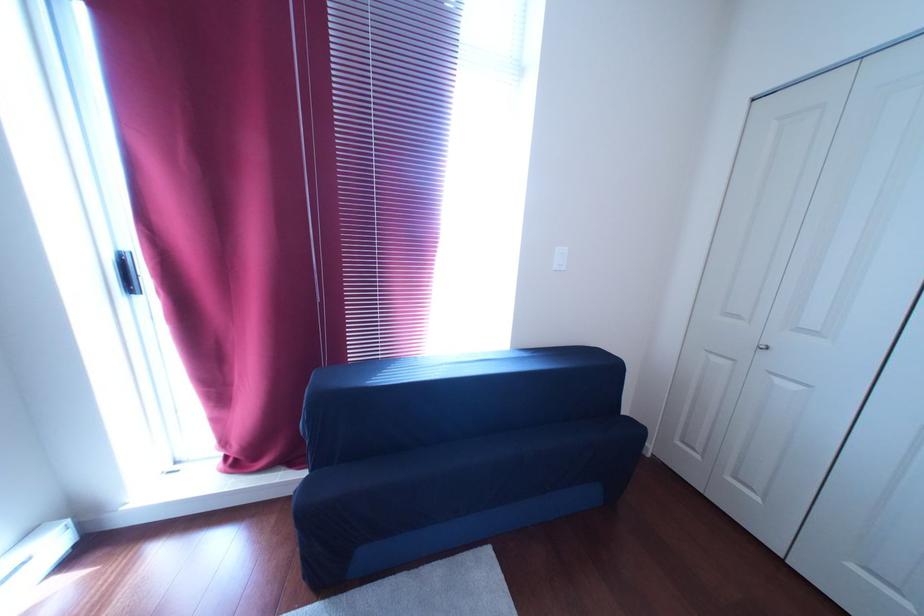
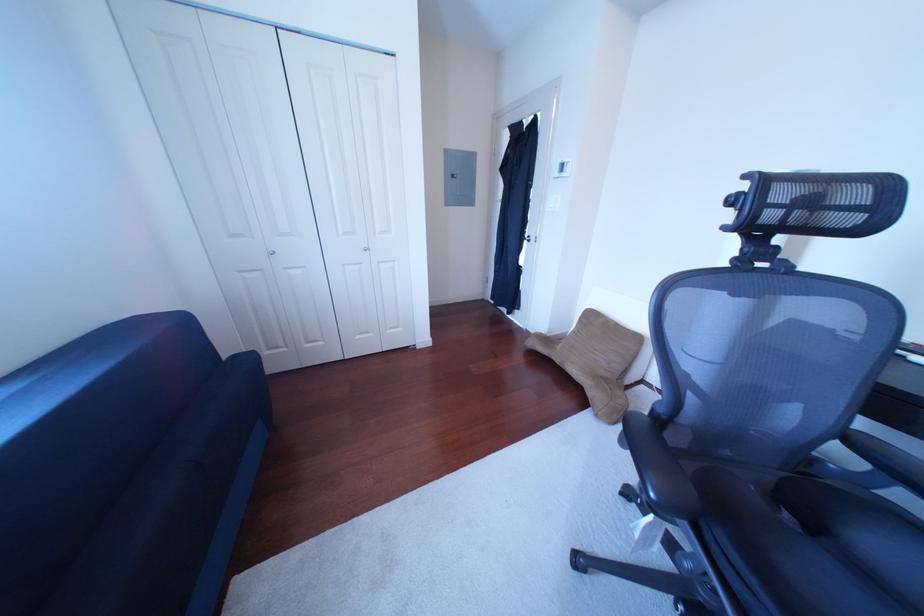
Based on the continuous images, in which direction is the camera rotating?

The camera's rotation is toward right-down.